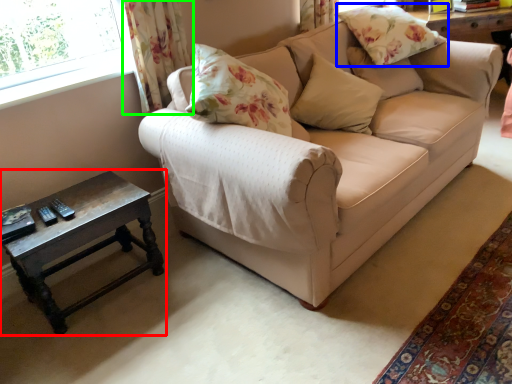
Question: Which object is positioned farthest from table (highlighted by a red box)? Select from pillow (highlighted by a blue box) and curtain (highlighted by a green box).

Choices:
 (A) pillow
 (B) curtain

Answer: (A)